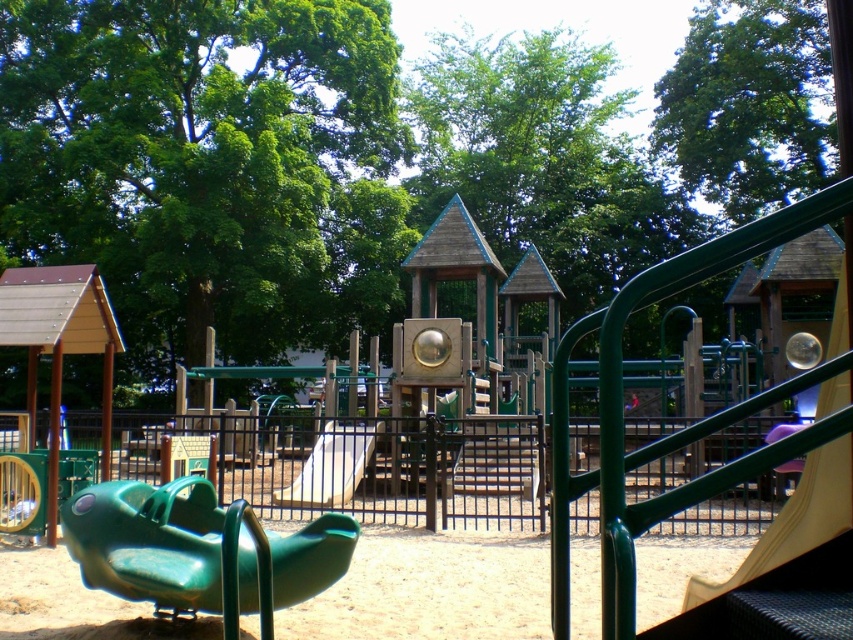
You are a parent watching your child play at the playground. You see the green plastic slide at lower left and the white matte slide at center. Which slide is physically closer to you?

The green plastic slide at lower left is closer to the viewer than the white matte slide at center, so the green plastic slide at lower left is physically closer to you.

You are a parent trying to decide which slide to let your child play on. You notice the green plastic slide at lower left and the white matte slide at center. Which slide is positioned more to the east side of the playground?

The green plastic slide at lower left is to the right of the white matte slide at center, so the white matte slide at center is positioned more to the east side of the playground.